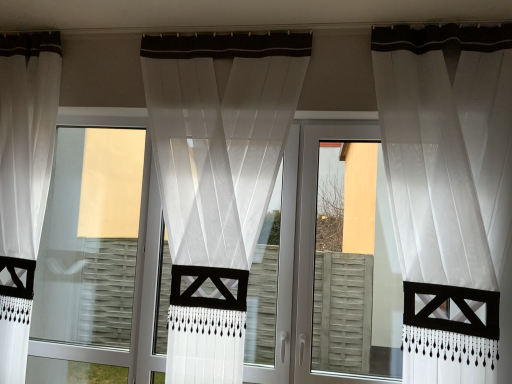
Question: Could you tell me if transparent glass window at center is turned towards sheer white curtain at center, acting as the second curtain starting from the left?

Choices:
 (A) no
 (B) yes

Answer: (A)

Question: Would you say sheer white curtain at center, acting as the second curtain starting from the left, is part of transparent glass window at center's contents?

Choices:
 (A) no
 (B) yes

Answer: (A)

Question: Is transparent glass window at center outside sheer white curtain at center, which is counted as the 2th curtain, starting from the right?

Choices:
 (A) no
 (B) yes

Answer: (B)

Question: Does transparent glass window at center have a smaller size compared to sheer white curtain at center, acting as the second curtain starting from the left?

Choices:
 (A) no
 (B) yes

Answer: (B)

Question: Is transparent glass window at center shorter than sheer white curtain at center, acting as the second curtain starting from the left?

Choices:
 (A) no
 (B) yes

Answer: (B)

Question: From the image's perspective, is transparent glass window at center beneath sheer white curtain at center, acting as the second curtain starting from the left?

Choices:
 (A) no
 (B) yes

Answer: (B)

Question: Can you confirm if sheer white curtain at center, acting as the second curtain starting from the left, is smaller than transparent glass window at center?

Choices:
 (A) yes
 (B) no

Answer: (B)

Question: Can you confirm if sheer white curtain at center, acting as the second curtain starting from the left, is taller than transparent glass window at center?

Choices:
 (A) yes
 (B) no

Answer: (A)

Question: Could you tell me if sheer white curtain at center, which is counted as the 2th curtain, starting from the right, is turned towards transparent glass window at center?

Choices:
 (A) no
 (B) yes

Answer: (A)

Question: Is sheer white curtain at center, which is counted as the 2th curtain, starting from the right, bigger than transparent glass window at center?

Choices:
 (A) no
 (B) yes

Answer: (B)

Question: Can you confirm if sheer white curtain at center, acting as the second curtain starting from the left, is positioned to the right of transparent glass window at center?

Choices:
 (A) yes
 (B) no

Answer: (A)

Question: Considering the relative sizes of sheer white curtain at center, acting as the second curtain starting from the left, and transparent glass window at center in the image provided, is sheer white curtain at center, acting as the second curtain starting from the left, thinner than transparent glass window at center?

Choices:
 (A) yes
 (B) no

Answer: (B)

Question: From a real-world perspective, is transparent fabric screen door at right on transparent glass window at center?

Choices:
 (A) no
 (B) yes

Answer: (B)